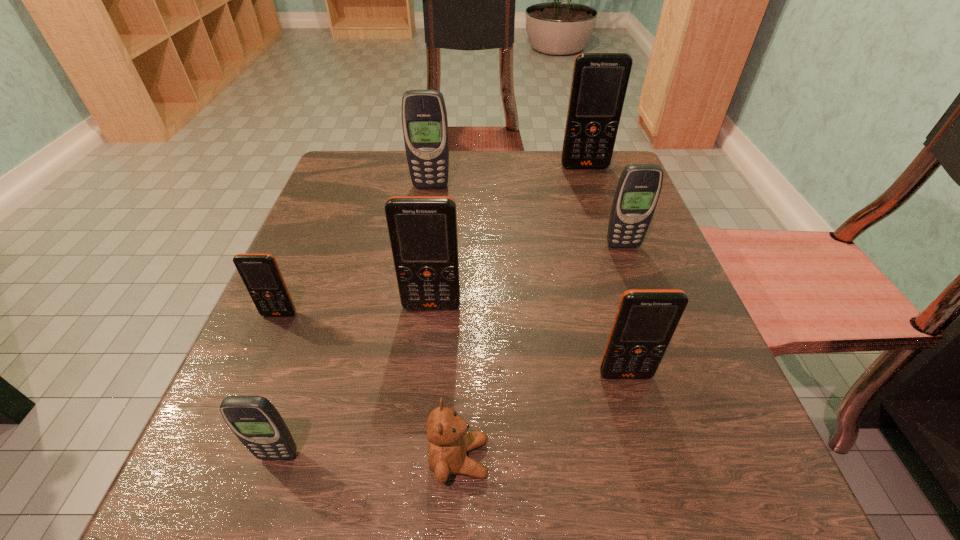
Image resolution: width=960 pixels, height=540 pixels. I want to click on the third closest object to the second smallest gray cellular telephone, so click(x=422, y=229).

Find the location of a particular element. Image resolution: width=960 pixels, height=540 pixels. object that is the sixth closest to the farthest object is located at coordinates (449, 441).

I want to click on cellular telephone that stands as the sixth closest to the second orange cellular telephone from left to right, so click(x=599, y=83).

Identify the location of cellular telephone that is the fifth closest to the third nearest object. The image size is (960, 540). (424, 117).

Locate an element on the screen. The width and height of the screenshot is (960, 540). orange cellular telephone that is the third closest to the leftmost cellular telephone is located at coordinates click(599, 83).

Identify the location of the third closest orange cellular telephone to the leftmost object. The width and height of the screenshot is (960, 540). (599, 83).

Locate which gray cellular telephone is the second closest to the farthest gray cellular telephone. Please provide its 2D coordinates. Your answer should be formatted as a tuple, i.e. [(x, y)], where the tuple contains the x and y coordinates of a point satisfying the conditions above.

[(255, 421)]

Identify which gray cellular telephone is the second closest to the third orange cellular telephone from right to left. Please provide its 2D coordinates. Your answer should be formatted as a tuple, i.e. [(x, y)], where the tuple contains the x and y coordinates of a point satisfying the conditions above.

[(638, 189)]